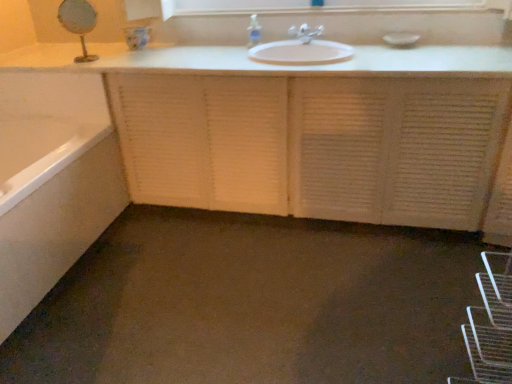
Question: Can we say white glossy bathtub at lower left lies outside matte white faucet at center?

Choices:
 (A) yes
 (B) no

Answer: (A)

Question: Is white glossy bathtub at lower left far from matte white faucet at center?

Choices:
 (A) no
 (B) yes

Answer: (B)

Question: Can you confirm if white glossy bathtub at lower left is smaller than matte white faucet at center?

Choices:
 (A) yes
 (B) no

Answer: (B)

Question: Is white glossy bathtub at lower left beside matte white faucet at center?

Choices:
 (A) yes
 (B) no

Answer: (B)

Question: Is white glossy bathtub at lower left positioned with its back to matte white faucet at center?

Choices:
 (A) yes
 (B) no

Answer: (B)

Question: Does white glossy bathtub at lower left have a larger size compared to matte white faucet at center?

Choices:
 (A) no
 (B) yes

Answer: (B)

Question: Considering the relative positions of clear plastic soap dispenser at upper center and white glossy medicine cabinet at upper center in the image provided, is clear plastic soap dispenser at upper center to the right of white glossy medicine cabinet at upper center from the viewer's perspective?

Choices:
 (A) yes
 (B) no

Answer: (B)

Question: From a real-world perspective, is clear plastic soap dispenser at upper center positioned under white glossy medicine cabinet at upper center based on gravity?

Choices:
 (A) no
 (B) yes

Answer: (B)

Question: Is clear plastic soap dispenser at upper center wider than white glossy medicine cabinet at upper center?

Choices:
 (A) yes
 (B) no

Answer: (B)

Question: Can you confirm if clear plastic soap dispenser at upper center is thinner than white glossy medicine cabinet at upper center?

Choices:
 (A) yes
 (B) no

Answer: (A)

Question: From the image's perspective, is clear plastic soap dispenser at upper center located above white glossy medicine cabinet at upper center?

Choices:
 (A) yes
 (B) no

Answer: (B)

Question: Is white glossy medicine cabinet at upper center surrounded by clear plastic soap dispenser at upper center?

Choices:
 (A) no
 (B) yes

Answer: (A)

Question: Can you confirm if clear plastic soap dispenser at upper center is wider than gold metallic mirror at upper left?

Choices:
 (A) no
 (B) yes

Answer: (A)